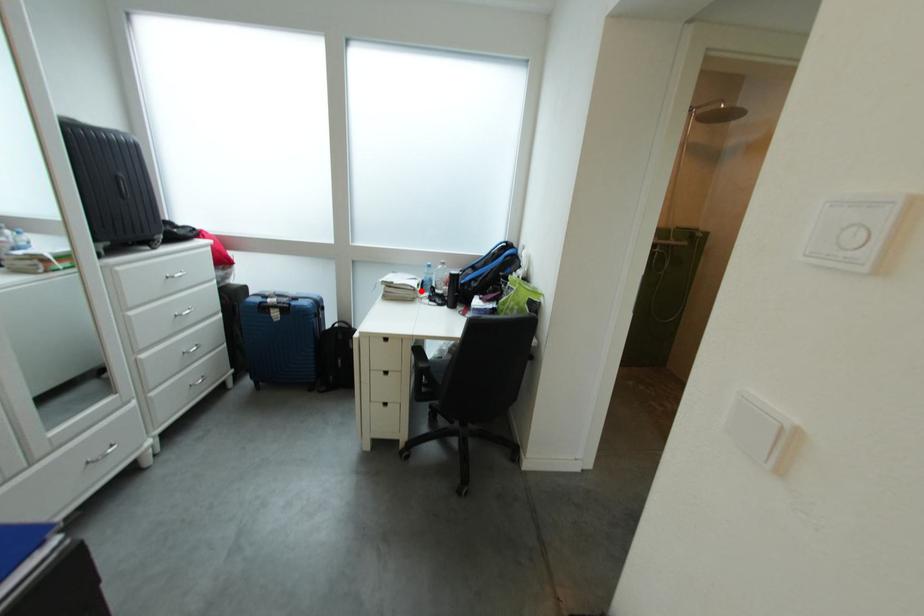
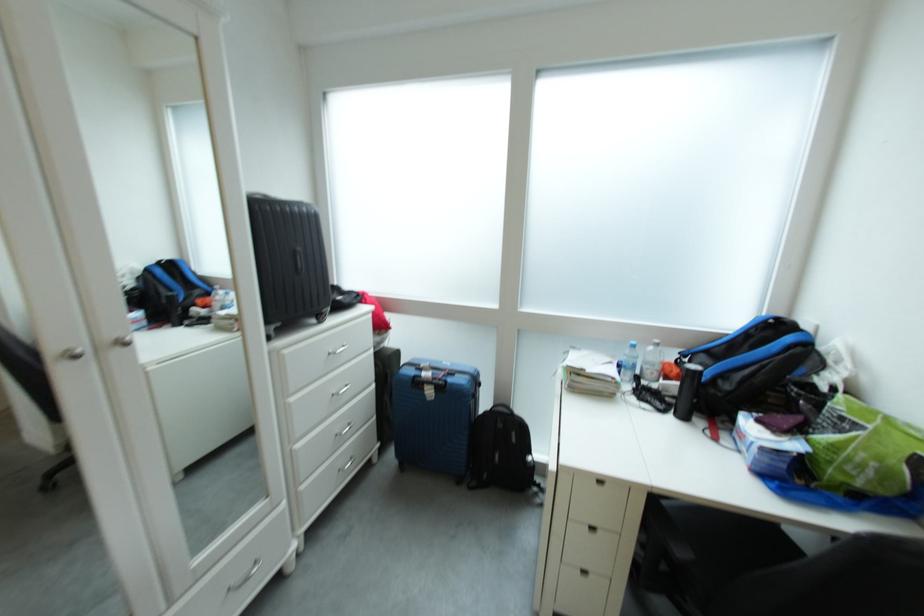
In the second image, find the point that corresponds to the highlighted location in the first image.

(622, 383)